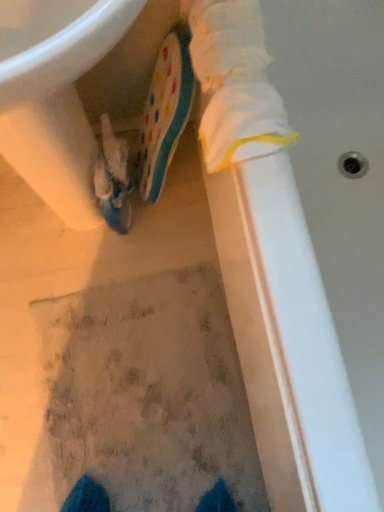
This screenshot has width=384, height=512. Identify the location of polka dot rubber boot at center, which is counted as the 1th footwear, starting from the right. (165, 112).

Describe the element at coordinates (165, 112) in the screenshot. I see `polka dot rubber boot at center, the 2th footwear from the left` at that location.

Identify the location of matte blue shoe at center, which ranks as the first footwear in left-to-right order. This screenshot has height=512, width=384. (113, 179).

This screenshot has width=384, height=512. What do you see at coordinates (113, 179) in the screenshot?
I see `matte blue shoe at center, which ranks as the first footwear in left-to-right order` at bounding box center [113, 179].

Measure the distance between point [182,508] and camera.

Point [182,508] is 38.74 inches away from camera.

The width and height of the screenshot is (384, 512). In order to click on polka dot rubber boot at center, which is counted as the 1th footwear, starting from the right in this screenshot , I will do `click(165, 112)`.

Is polka dot rubber boot at center, which is counted as the 1th footwear, starting from the right, in front of or behind textured gray mat at center in the image?

Clearly, polka dot rubber boot at center, which is counted as the 1th footwear, starting from the right, is in front of textured gray mat at center.

From the image's perspective, which is below, polka dot rubber boot at center, which is counted as the 1th footwear, starting from the right, or textured gray mat at center?

textured gray mat at center appears lower in the image.

Based on the photo, from a real-world perspective, between polka dot rubber boot at center, which is counted as the 1th footwear, starting from the right, and textured gray mat at center, who is vertically lower?

In real-world perspective, textured gray mat at center is lower.

Measure the distance from white glossy sink at upper left to polka dot rubber boot at center, the 2th footwear from the left.

A distance of 9.36 inches exists between white glossy sink at upper left and polka dot rubber boot at center, the 2th footwear from the left.

Considering the sizes of objects white glossy sink at upper left and polka dot rubber boot at center, the 2th footwear from the left, in the image provided, who is taller, white glossy sink at upper left or polka dot rubber boot at center, the 2th footwear from the left,?

white glossy sink at upper left.

Is polka dot rubber boot at center, the 2th footwear from the left, inside white glossy sink at upper left?

Yes, white glossy sink at upper left is surrounding polka dot rubber boot at center, the 2th footwear from the left.

From the image's perspective, is textured gray mat at center on white glossy sink at upper left?

No.

Based on the photo, which object is positioned more to the left, textured gray mat at center or white glossy sink at upper left?

Positioned to the left is white glossy sink at upper left.

Is textured gray mat at center inside the boundaries of white glossy sink at upper left, or outside?

textured gray mat at center is not enclosed by white glossy sink at upper left.

Does textured gray mat at center have a lesser height compared to polka dot rubber boot at center, which is counted as the 1th footwear, starting from the right?

Yes.

Is textured gray mat at center positioned behind polka dot rubber boot at center, the 2th footwear from the left?

Yes, the depth of textured gray mat at center is greater than that of polka dot rubber boot at center, the 2th footwear from the left.

Is point (162, 511) positioned in front of point (177, 136)?

No, it is behind (177, 136).

From the image's perspective, relative to polka dot rubber boot at center, which is counted as the 1th footwear, starting from the right, is textured gray mat at center above or below?

Clearly, from the image's perspective, textured gray mat at center is below polka dot rubber boot at center, which is counted as the 1th footwear, starting from the right.

Which is more distant, (x=81, y=22) or (x=221, y=359)?

The point (x=221, y=359) is farther.

Does white glossy sink at upper left lie behind textured gray mat at center?

No, white glossy sink at upper left is closer to the camera.

You are a GUI agent. You are given a task and a screenshot of the screen. Output one action in this format:
    pyautogui.click(x=<x>, y=<y>)
    Task: Click on the sink that appears on the left of textured gray mat at center
    Image resolution: width=384 pixels, height=512 pixels.
    Given the screenshot: What is the action you would take?
    pyautogui.click(x=55, y=95)

Is white glossy sink at upper left wider or thinner than textured gray mat at center?

In the image, white glossy sink at upper left appears to be more narrow than textured gray mat at center.

Considering the sizes of white glossy sink at upper left and matte blue shoe at center, which ranks as the first footwear in left-to-right order, in the image, is white glossy sink at upper left taller or shorter than matte blue shoe at center, which ranks as the first footwear in left-to-right order,?

Considering their sizes, white glossy sink at upper left has more height than matte blue shoe at center, which ranks as the first footwear in left-to-right order.

From the image's perspective, which one is positioned higher, white glossy sink at upper left or matte blue shoe at center, which ranks as the first footwear in left-to-right order?

From the image's view, white glossy sink at upper left is above.

Can you confirm if white glossy sink at upper left is smaller than matte blue shoe at center, which ranks as the first footwear in left-to-right order?

No, white glossy sink at upper left is not smaller than matte blue shoe at center, which ranks as the first footwear in left-to-right order.

Which object is positioned more to the left, white glossy sink at upper left or matte blue shoe at center, which ranks as the first footwear in left-to-right order?

From the viewer's perspective, white glossy sink at upper left appears more on the left side.

Is matte blue shoe at center, which ranks as the first footwear in left-to-right order, to the right of white glossy sink at upper left from the viewer's perspective?

Correct, you'll find matte blue shoe at center, which ranks as the first footwear in left-to-right order, to the right of white glossy sink at upper left.

Which of these two, matte blue shoe at center, the 2th footwear when ordered from right to left, or white glossy sink at upper left, stands taller?

white glossy sink at upper left.

Between point (125, 152) and point (26, 132), which one is positioned behind?

The point (125, 152) is behind.

In order to click on footprint below the polka dot rubber boot at center, the 2th footwear from the left (from the image's perspective) in this screenshot , I will do `click(143, 396)`.

The height and width of the screenshot is (512, 384). I want to click on sink that is in front of the polka dot rubber boot at center, which is counted as the 1th footwear, starting from the right, so click(x=55, y=95).

Estimate the real-world distances between objects in this image. Which object is further from matte blue shoe at center, the 2th footwear when ordered from right to left, white glossy sink at upper left or polka dot rubber boot at center, which is counted as the 1th footwear, starting from the right?

white glossy sink at upper left lies further to matte blue shoe at center, the 2th footwear when ordered from right to left, than the other object.

Estimate the real-world distances between objects in this image. Which object is closer to textured gray mat at center, polka dot rubber boot at center, which is counted as the 1th footwear, starting from the right, or matte blue shoe at center, which ranks as the first footwear in left-to-right order?

matte blue shoe at center, which ranks as the first footwear in left-to-right order, lies closer to textured gray mat at center than the other object.

When comparing their distances from textured gray mat at center, does matte blue shoe at center, which ranks as the first footwear in left-to-right order, or white glossy sink at upper left seem further?

white glossy sink at upper left is positioned further to the anchor textured gray mat at center.

Estimate the real-world distances between objects in this image. Which object is closer to polka dot rubber boot at center, the 2th footwear from the left, white glossy sink at upper left or textured gray mat at center?

white glossy sink at upper left lies closer to polka dot rubber boot at center, the 2th footwear from the left, than the other object.

From the image, which object appears to be farther from textured gray mat at center, polka dot rubber boot at center, the 2th footwear from the left, or white glossy sink at upper left?

Among the two, polka dot rubber boot at center, the 2th footwear from the left, is located further to textured gray mat at center.

Considering their positions, is polka dot rubber boot at center, the 2th footwear from the left, positioned closer to matte blue shoe at center, the 2th footwear when ordered from right to left, than white glossy sink at upper left?

The object closer to matte blue shoe at center, the 2th footwear when ordered from right to left, is polka dot rubber boot at center, the 2th footwear from the left.

Based on the photo, considering their positions, is textured gray mat at center positioned closer to matte blue shoe at center, which ranks as the first footwear in left-to-right order, than polka dot rubber boot at center, which is counted as the 1th footwear, starting from the right?

polka dot rubber boot at center, which is counted as the 1th footwear, starting from the right, is positioned closer to the anchor matte blue shoe at center, which ranks as the first footwear in left-to-right order.

When comparing their distances from polka dot rubber boot at center, the 2th footwear from the left, does matte blue shoe at center, which ranks as the first footwear in left-to-right order, or textured gray mat at center seem further?

Based on the image, textured gray mat at center appears to be further to polka dot rubber boot at center, the 2th footwear from the left.

I want to click on footwear between white glossy sink at upper left and matte blue shoe at center, which ranks as the first footwear in left-to-right order, from front to back, so click(165, 112).

Find the location of `footwear that lies between polka dot rubber boot at center, which is counted as the 1th footwear, starting from the right, and textured gray mat at center from top to bottom`. footwear that lies between polka dot rubber boot at center, which is counted as the 1th footwear, starting from the right, and textured gray mat at center from top to bottom is located at coordinates (113, 179).